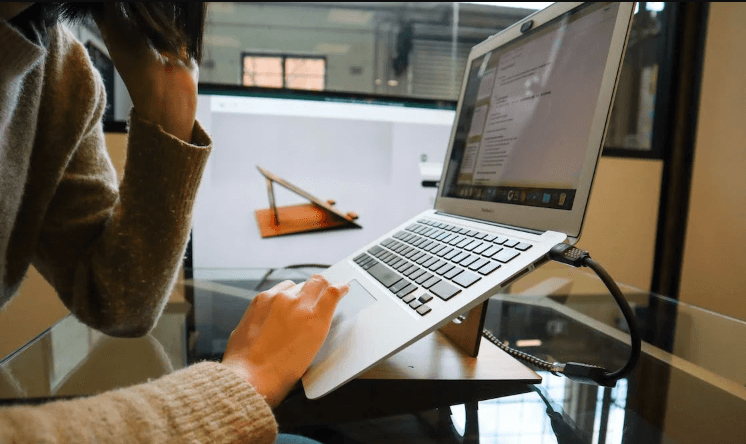
The image size is (746, 444). In order to click on window in this screenshot , I will do `click(315, 56)`.